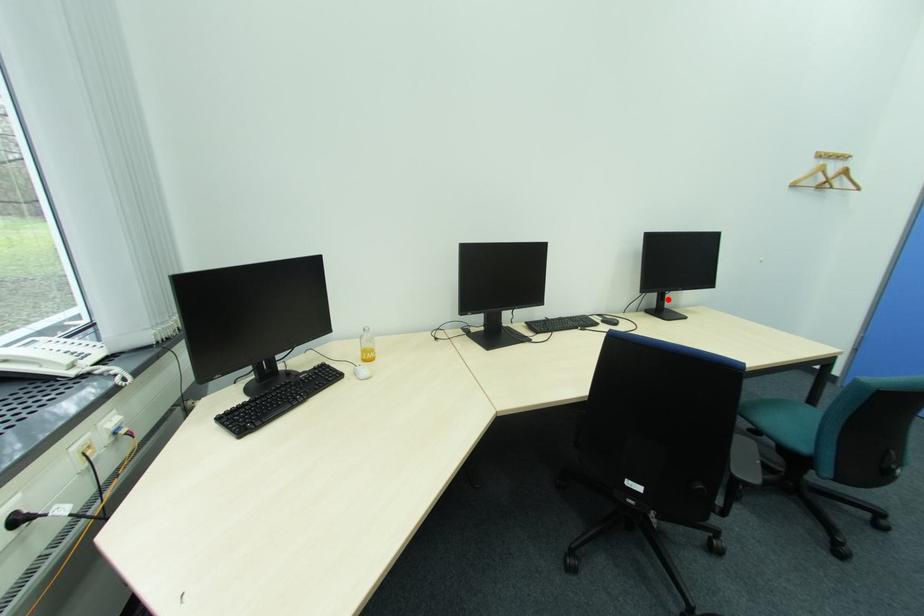
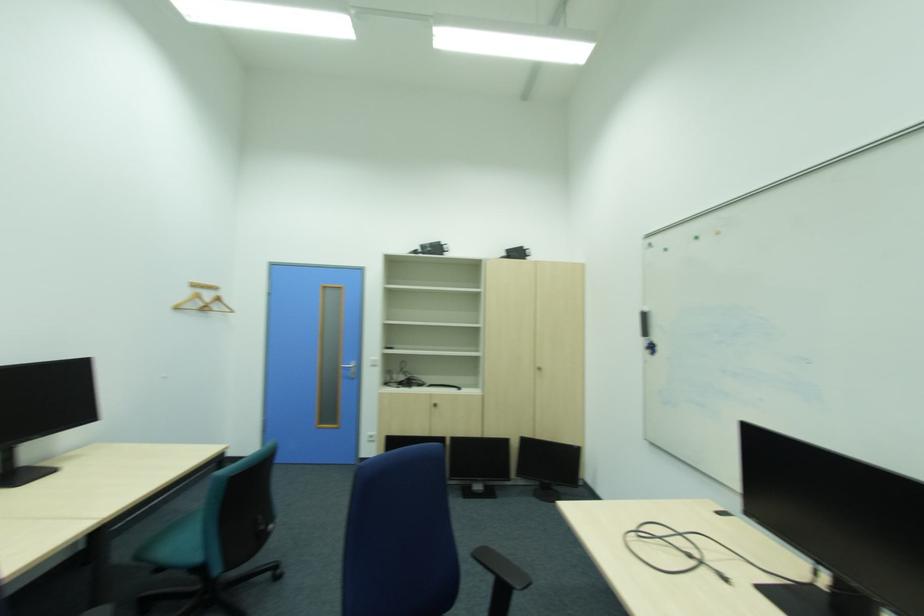
In the second image, find the point that corresponds to the highlighted location in the first image.

(13, 459)